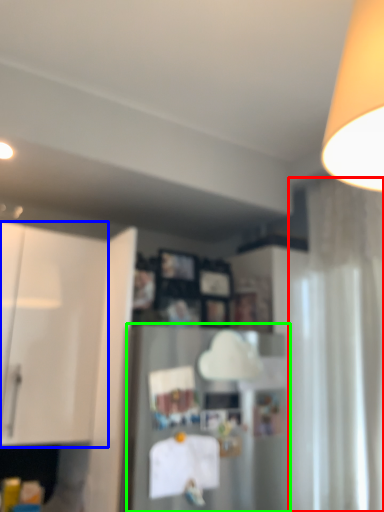
Question: Which object is positioned closest to curtain (highlighted by a red box)? Select from cabinetry (highlighted by a blue box) and appliance (highlighted by a green box).

Choices:
 (A) cabinetry
 (B) appliance

Answer: (B)